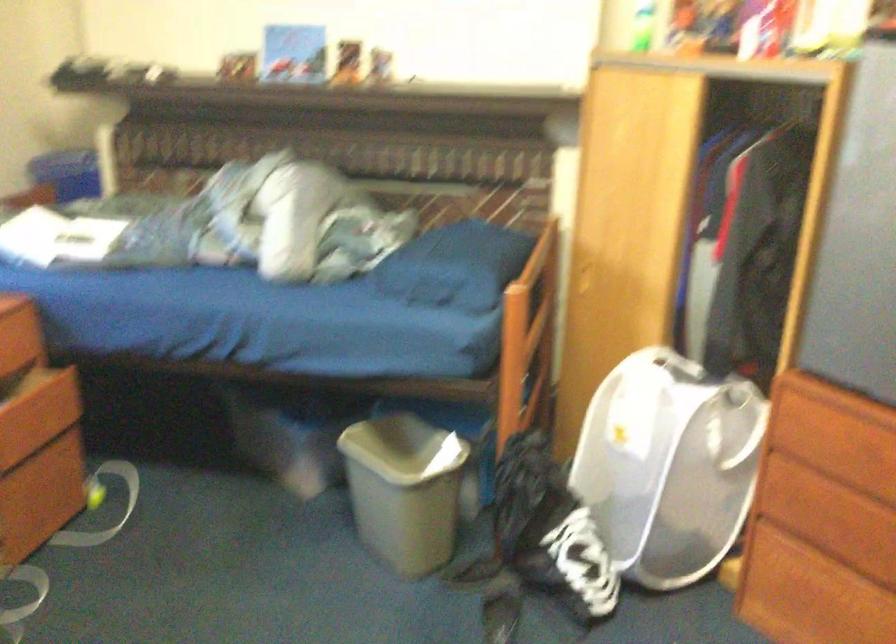
Find where to push the white box fan. Please return your answer as a coordinate pair (x, y).

(668, 466)